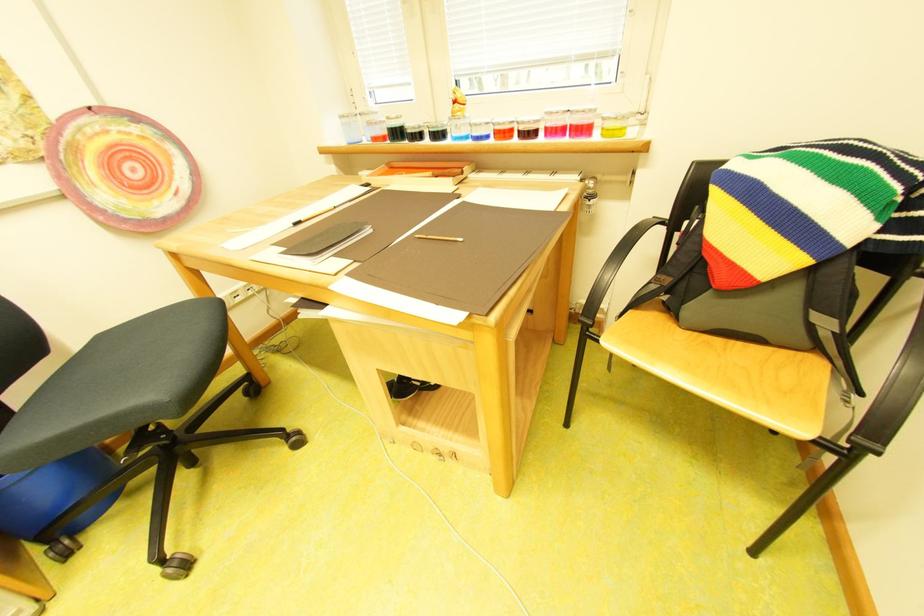
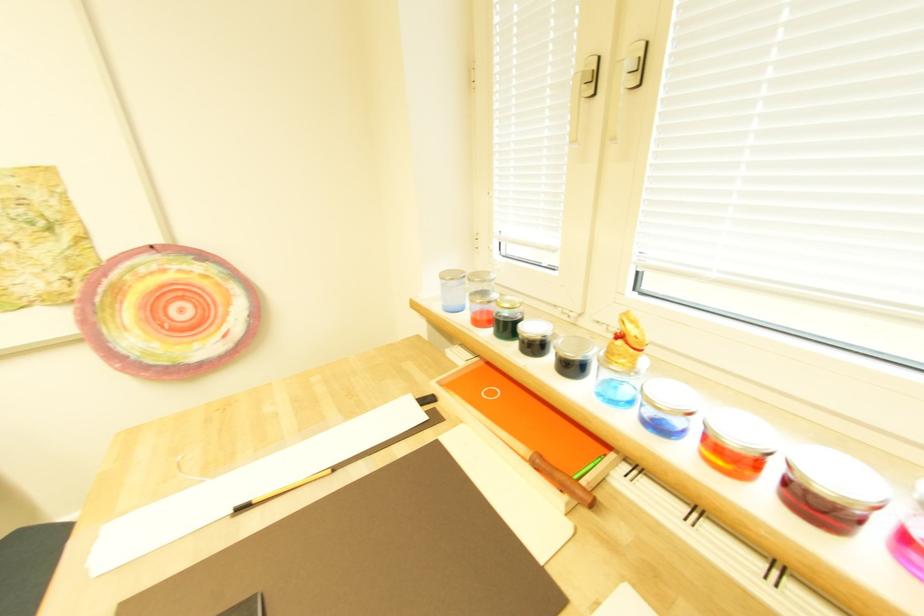
Question: The camera is either moving clockwise (left) or counter-clockwise (right) around the object. The first image is from the beginning of the video and the second image is from the end. Is the camera moving left or right when shooting the video?

Choices:
 (A) Left
 (B) Right

Answer: (B)